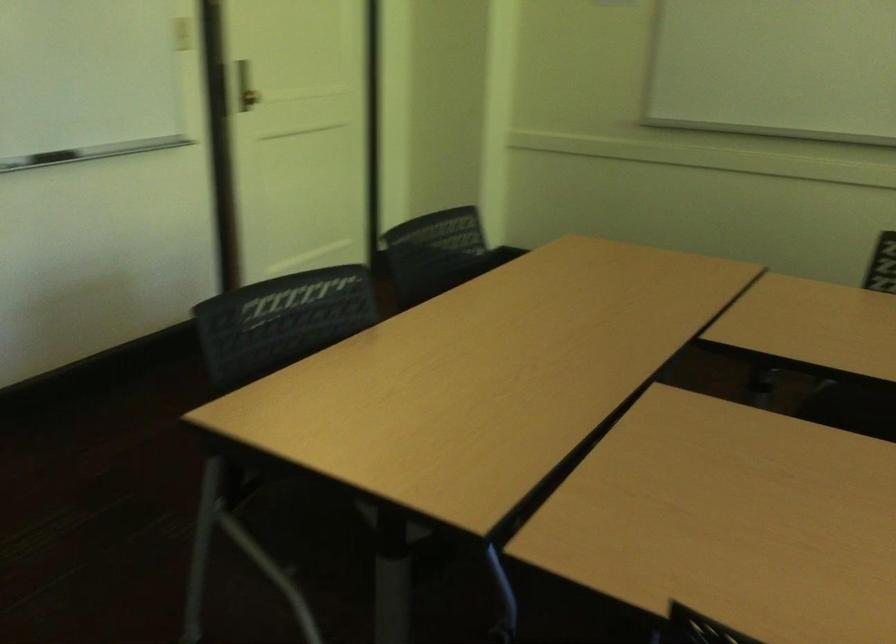
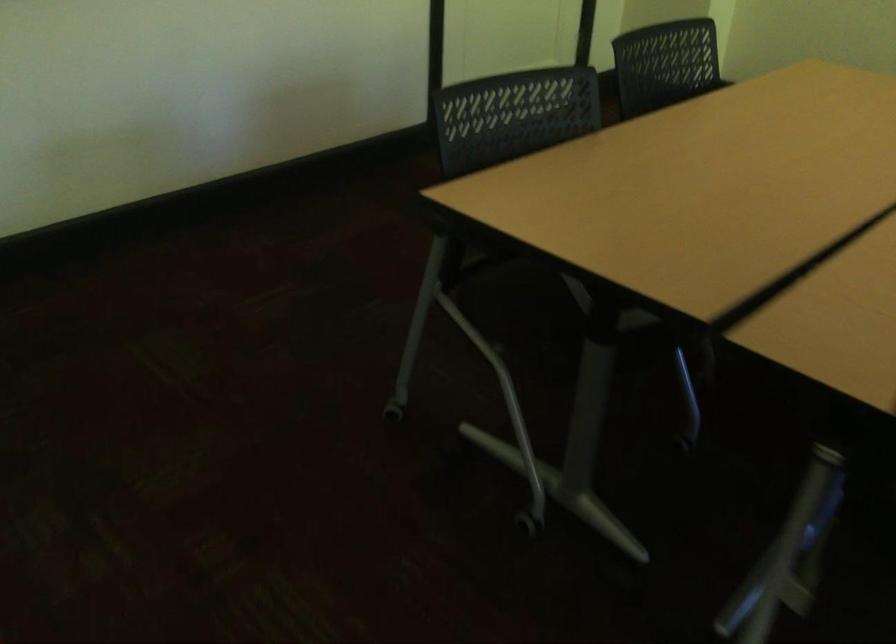
Question: Based on the continuous images, in which direction is the camera rotating? Reply with the corresponding letter.

Choices:
 (A) Left
 (B) Right
 (C) Up
 (D) Down

Answer: (D)